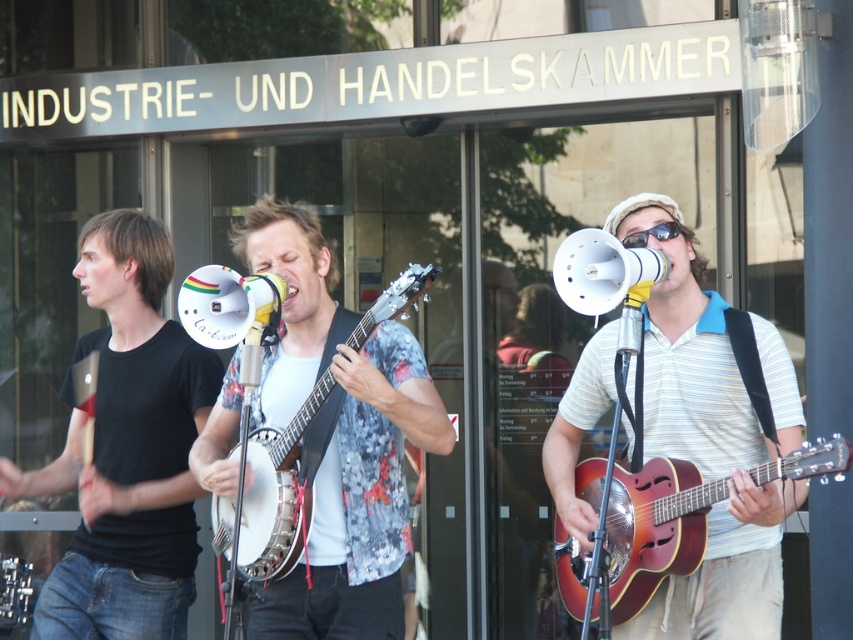
Does striped cotton shirt at center have a smaller size compared to black matte t-shirt at left?

Incorrect, striped cotton shirt at center is not smaller in size than black matte t-shirt at left.

Does striped cotton shirt at center have a lesser height compared to black matte t-shirt at left?

Yes.

Does point (775, 385) lie in front of point (200, 420)?

Yes, point (775, 385) is in front of point (200, 420).

At what (x,y) coordinates should I click in order to perform the action: click on striped cotton shirt at center. Please return your answer as a coordinate pair (x, y). Looking at the image, I should click on (711, 435).

Between point (134, 618) and point (323, 396), which one is positioned behind?

Point (134, 618)

Can you confirm if black matte t-shirt at left is smaller than white wood banjo at center?

Actually, black matte t-shirt at left might be larger than white wood banjo at center.

Which is behind, point (177, 596) or point (260, 509)?

The point (177, 596) is behind.

This screenshot has width=853, height=640. I want to click on black matte t-shirt at left, so click(126, 449).

Which is above, striped cotton shirt at center or white wood banjo at center?

white wood banjo at center is higher up.

Can you confirm if striped cotton shirt at center is taller than white wood banjo at center?

Correct, striped cotton shirt at center is much taller as white wood banjo at center.

Between point (648, 449) and point (306, 529), which one is positioned behind?

Positioned behind is point (648, 449).

The image size is (853, 640). I want to click on striped cotton shirt at center, so click(x=711, y=435).